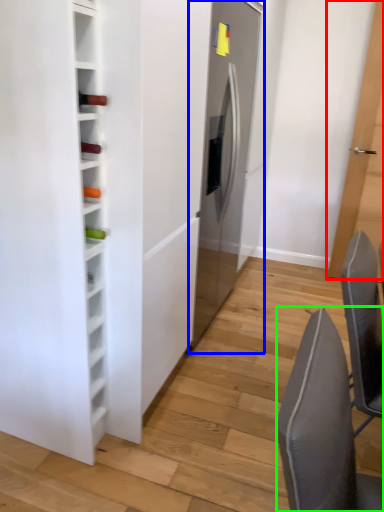
Question: Which object is positioned closest to door (highlighted by a red box)? Select from fridge (highlighted by a blue box) and chair (highlighted by a green box).

Choices:
 (A) fridge
 (B) chair

Answer: (A)